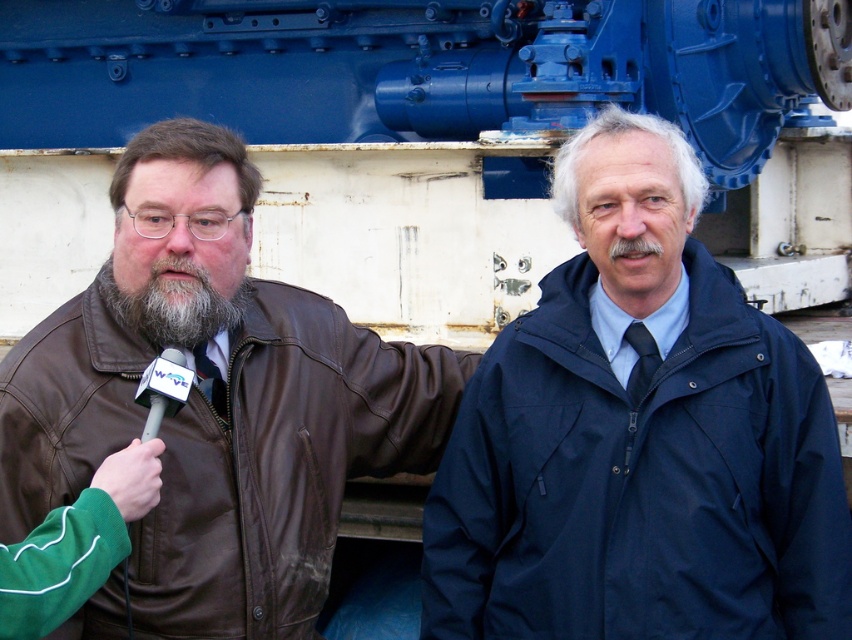
Which is more to the left, navy blue waterproof jacket at right or graywoollybeard at left?

From the viewer's perspective, graywoollybeard at left appears more on the left side.

Who is higher up, navy blue waterproof jacket at right or graywoollybeard at left?

graywoollybeard at left

What do you see at coordinates (640, 483) in the screenshot? This screenshot has width=852, height=640. I see `navy blue waterproof jacket at right` at bounding box center [640, 483].

You are a GUI agent. You are given a task and a screenshot of the screen. Output one action in this format:
    pyautogui.click(x=<x>, y=<y>)
    Task: Click on the navy blue waterproof jacket at right
    The width and height of the screenshot is (852, 640).
    Given the screenshot: What is the action you would take?
    pyautogui.click(x=640, y=483)

Does point (373, 355) lie in front of point (137, 388)?

That is False.

Does brown leather jacket at left have a greater width compared to white plastic microphone at left?

Correct, the width of brown leather jacket at left exceeds that of white plastic microphone at left.

Find the location of `brown leather jacket at left`. brown leather jacket at left is located at coordinates (281, 467).

Who is lower down, navy blue waterproof jacket at right or white plastic microphone at left?

navy blue waterproof jacket at right is below.

Which is in front, point (468, 480) or point (171, 356)?

Positioned in front is point (171, 356).

In order to click on navy blue waterproof jacket at right in this screenshot , I will do `click(640, 483)`.